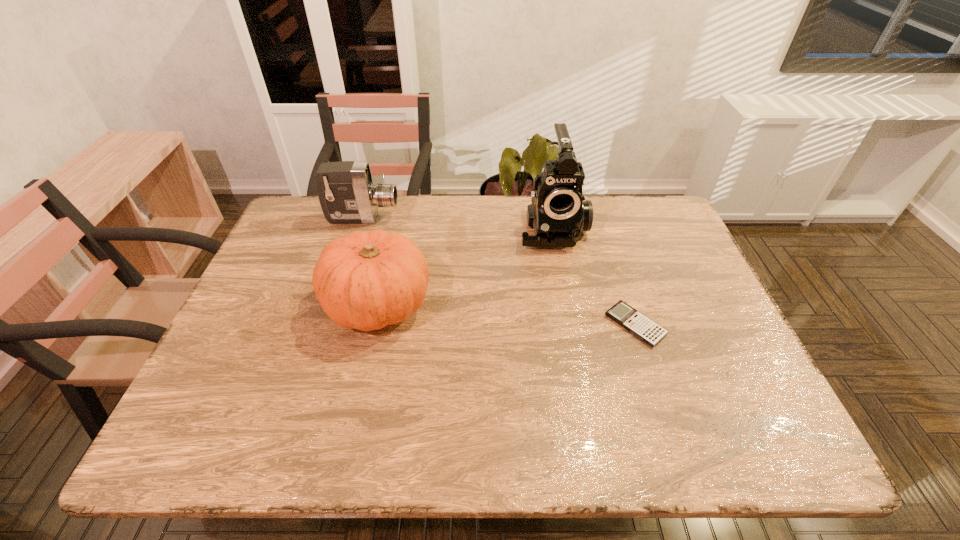
Locate an element on the screen. The height and width of the screenshot is (540, 960). free spot between the taller camcorder and the calculator is located at coordinates (593, 276).

The height and width of the screenshot is (540, 960). What are the coordinates of `free space between the shortest object and the right camcorder` in the screenshot? It's located at click(593, 276).

The width and height of the screenshot is (960, 540). Find the location of `vacant area between the pumpkin and the right camcorder`. vacant area between the pumpkin and the right camcorder is located at coordinates (466, 266).

Identify the location of vacant area that lies between the left camcorder and the shortest object. This screenshot has width=960, height=540. (499, 271).

Where is `vacant space that's between the right camcorder and the pumpkin`? This screenshot has height=540, width=960. vacant space that's between the right camcorder and the pumpkin is located at coordinates (466, 266).

Find the location of a particular element. The image size is (960, 540). unoccupied area between the shortest object and the shorter camcorder is located at coordinates (499, 271).

Find the location of a particular element. This screenshot has height=540, width=960. vacant area between the shortest object and the shorter camcorder is located at coordinates 499,271.

Select which object is the closest to the shortest object. Please provide its 2D coordinates. Your answer should be formatted as a tuple, i.e. [(x, y)], where the tuple contains the x and y coordinates of a point satisfying the conditions above.

[(558, 213)]

This screenshot has height=540, width=960. Find the location of `the second closest object to the shorter camcorder`. the second closest object to the shorter camcorder is located at coordinates (558, 213).

Locate an element on the screen. vacant space that satisfies the following two spatial constraints: 1. on the back side of the pumpkin; 2. at the front of the shorter camcorder, highlighting the lens is located at coordinates (397, 218).